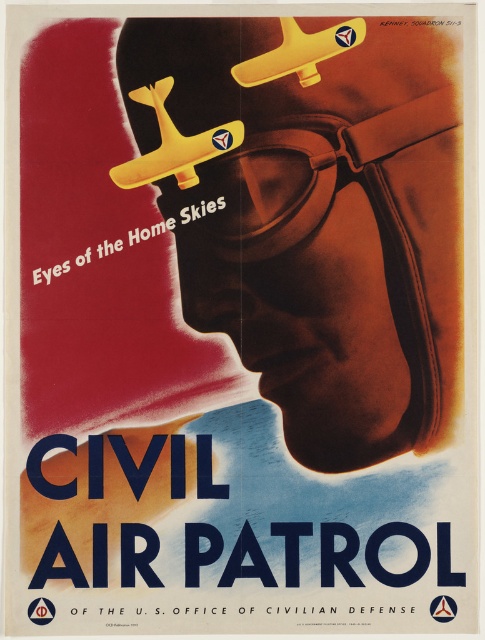
What is located at the point marked by the coordinates (442,609) on the vintage Civil Air Patrol poster?

The point marked by the coordinates (442,609) on the vintage Civil Air Patrol poster is the location of the metallic star at center.

Based on the provided image description, where is the metallic star at center located in terms of its 2D coordinates?

The metallic star at center is located at the 2D coordinates of point (442, 609).

Based on the scene described, which object is taller between the metallic star at center and the metallic red star at center?

The metallic star at center is taller than the metallic red star at center.